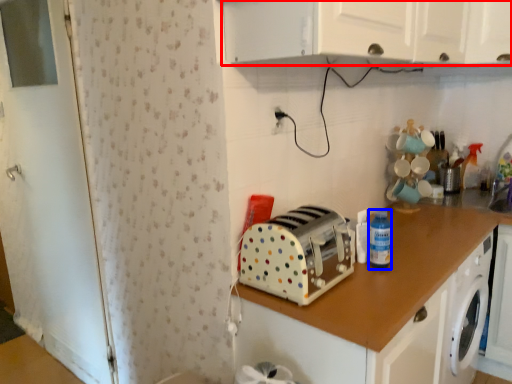
Question: Which object appears closest to the camera in this image, cabinetry (highlighted by a red box) or bottle (highlighted by a blue box)?

Choices:
 (A) cabinetry
 (B) bottle

Answer: (A)